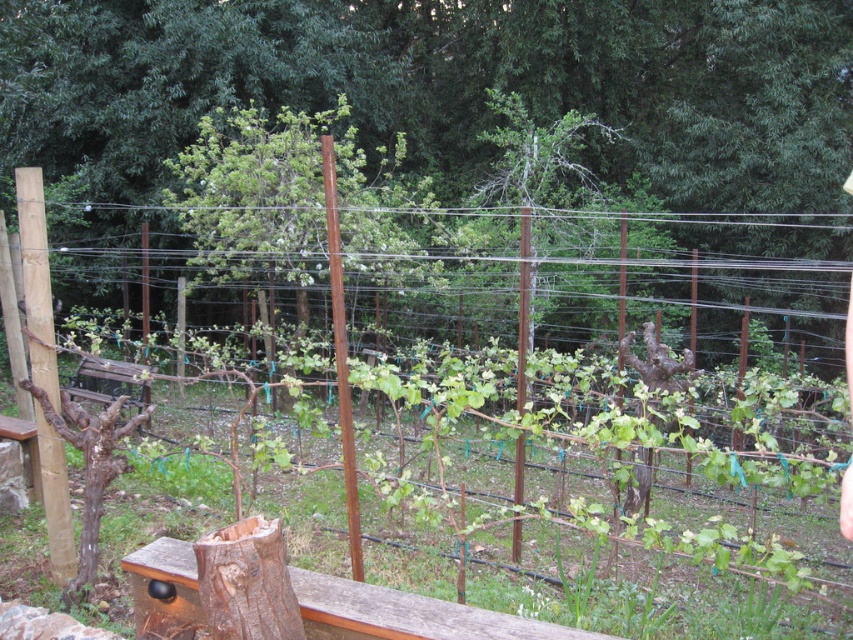
You are a photographer standing in the vineyard and want to take a photo of the brown wood tree at center. If your camera has a maximum focus range of 12 meters, will you be able to capture the tree clearly?

The brown wood tree at center is 13.39 meters away from camera, which exceeds the camera maximum focus range of 12 meters. Therefore, the tree will be out of focus and not captured clearly.

You are standing at the entrance of the vineyard and want to find the brown wood tree at center. According to the coordinates provided, where should you look relative to your position?

The brown wood tree at center is located at coordinates point [442,88], which means it is positioned to the left and slightly forward from your current position at the entrance.

You are a gardener planning to install a new decorative tree in your vineyard. You have a brown wood tree at center and a rusty wire fence at center in the image. Which object is taller and would cast a larger shadow during midday?

The brown wood tree at center is taller than the rusty wire fence at center, so it would cast a larger shadow during midday.